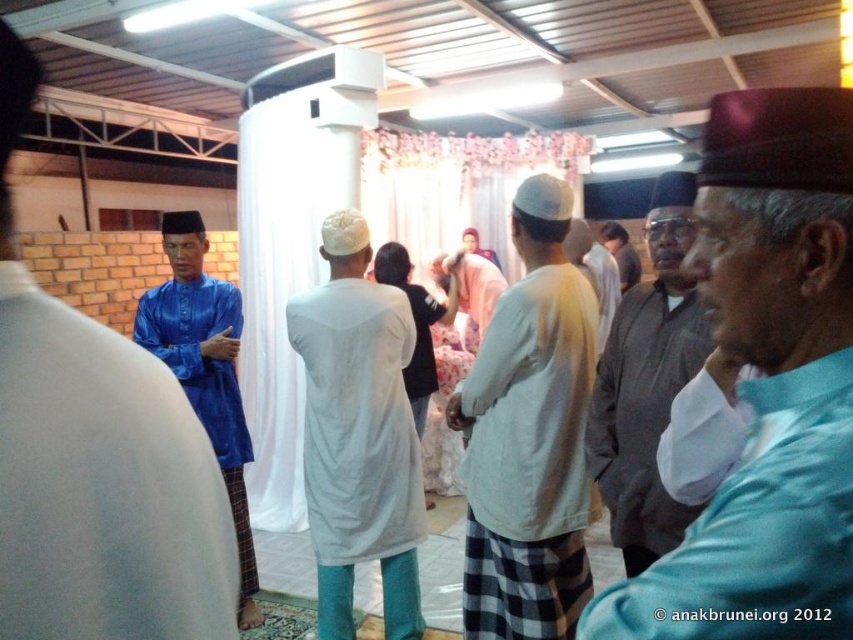
You are organizing a seating arrangement for a cultural event and need to place two items in the center of the room. The gray matte jacket at center and the white cotton robe at center must be displayed. Which item requires more space due to its size?

The gray matte jacket at center requires more space because it has a larger size compared to the white cotton robe at center.

You are a photographer taking pictures of the event. You notice the light blue shirt at center and the white matte tunic at center. Which one is positioned higher in the image?

The light blue shirt at center is positioned higher in the image as it is above the white matte tunic at center.